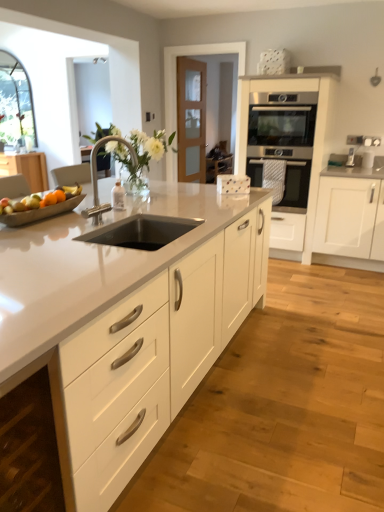
Question: Can you confirm if satin white oven at center, marked as the 2th cabinetry in a right-to-left arrangement, is wider than black stainless steel sink at center?

Choices:
 (A) no
 (B) yes

Answer: (B)

Question: From the image's perspective, does satin white oven at center, positioned as the 2th cabinetry in left-to-right order, appear higher than black stainless steel sink at center?

Choices:
 (A) no
 (B) yes

Answer: (B)

Question: Is satin white oven at center, which is the 3th cabinetry in front-to-back order, positioned before black stainless steel sink at center?

Choices:
 (A) yes
 (B) no

Answer: (B)

Question: Does satin white oven at center, which is counted as the 1th cabinetry, starting from the back, have a greater height compared to black stainless steel sink at center?

Choices:
 (A) no
 (B) yes

Answer: (B)

Question: Is satin white oven at center, marked as the 2th cabinetry in a right-to-left arrangement, further to the viewer compared to black stainless steel sink at center?

Choices:
 (A) no
 (B) yes

Answer: (B)

Question: Does satin white oven at center, marked as the 2th cabinetry in a right-to-left arrangement, touch black stainless steel sink at center?

Choices:
 (A) no
 (B) yes

Answer: (A)

Question: Is silver metallic faucet at center at the right side of white glossy countertop at center?

Choices:
 (A) no
 (B) yes

Answer: (B)

Question: Is silver metallic faucet at center shorter than white glossy countertop at center?

Choices:
 (A) yes
 (B) no

Answer: (A)

Question: Is silver metallic faucet at center outside of white glossy countertop at center?

Choices:
 (A) no
 (B) yes

Answer: (B)

Question: Is silver metallic faucet at center placed right next to white glossy countertop at center?

Choices:
 (A) no
 (B) yes

Answer: (A)

Question: Is silver metallic faucet at center aimed at white glossy countertop at center?

Choices:
 (A) no
 (B) yes

Answer: (A)

Question: Considering the relative sizes of silver metallic faucet at center and white glossy countertop at center in the image provided, is silver metallic faucet at center thinner than white glossy countertop at center?

Choices:
 (A) no
 (B) yes

Answer: (B)

Question: Is white matte cabinet at lower left, placed as the 1th cabinetry when sorted from front to back, outside of satin white oven at center, positioned as the 2th cabinetry in left-to-right order?

Choices:
 (A) no
 (B) yes

Answer: (B)